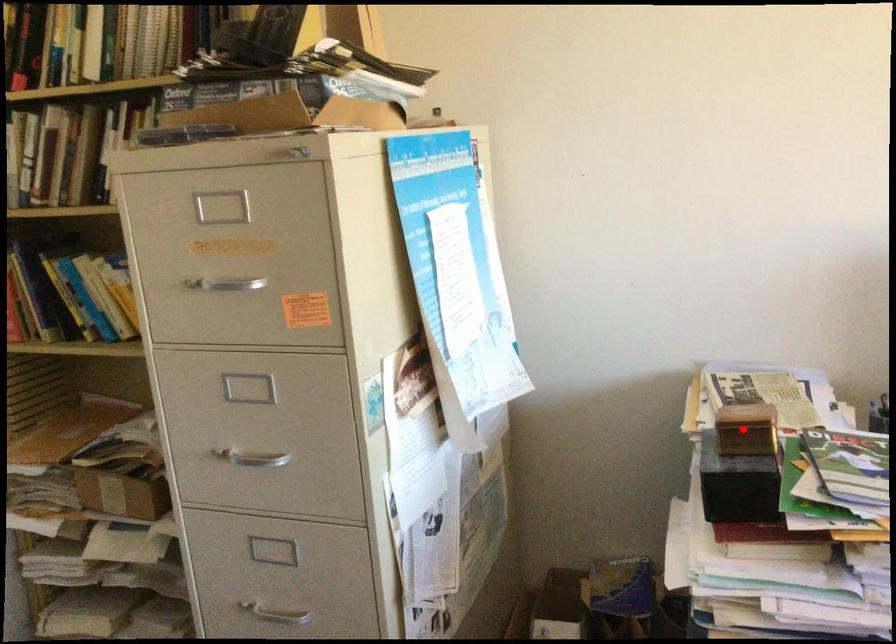
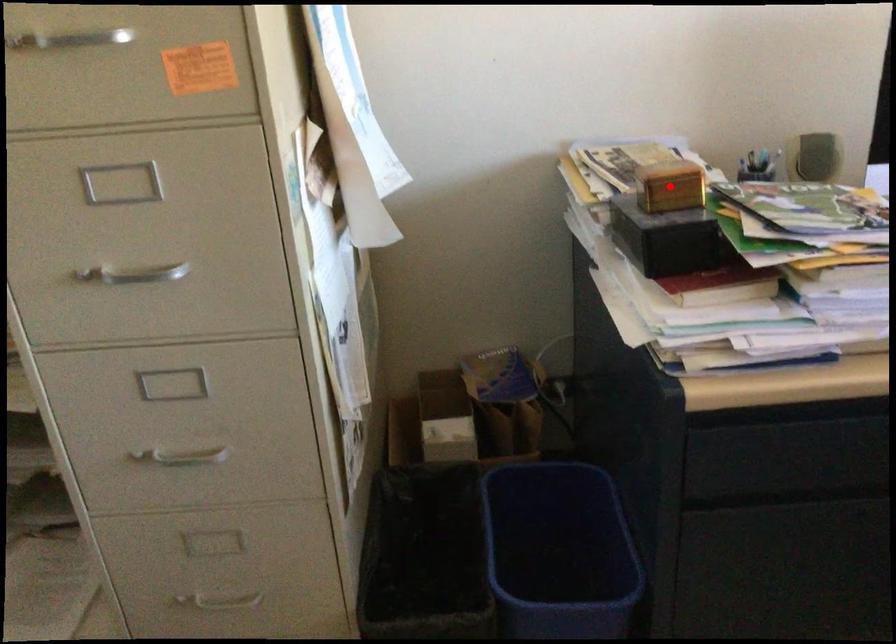
I am providing you with two images of the same scene from different viewpoints. A red point is marked on the first image and another point is marked on the second image. Are the points marked in image1 and image2 representing the same 3D position?

Yes